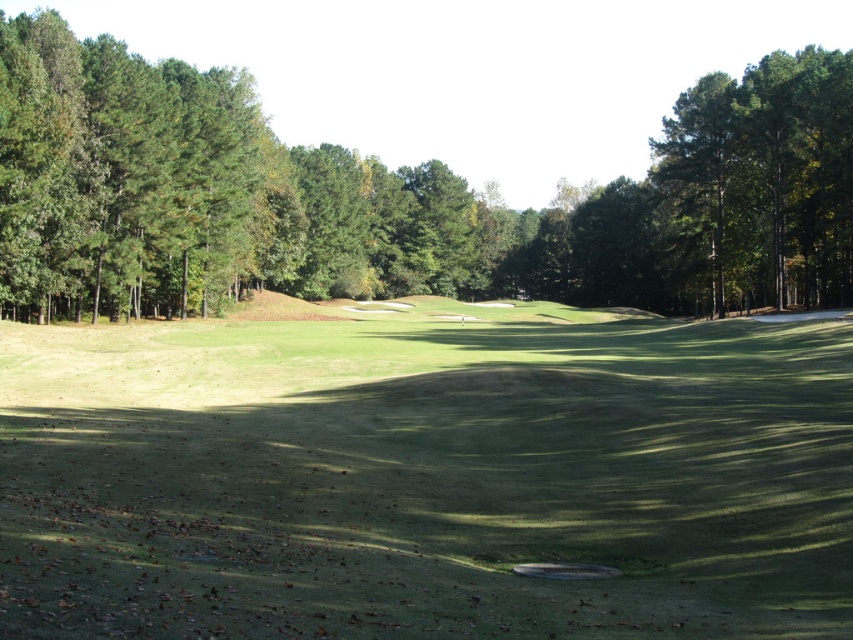
You are a golfer standing on the green grassy field at center and want to hit the ball towards the sand trap in the distance. Which direction should you aim relative to the green leafy tree at center?

Since the green grassy field at center is positioned under the green leafy tree at center, you should aim towards the direction away from the tree to reach the sand trap in the distance.

Looking at this image, you are a golfer standing on the green grassy field at center and want to hit the ball towards the green leafy tree at center. Since both are at the center, which direction should you aim to reach the tree?

The green grassy field at center is in front of the green leafy tree at center, so you should aim towards the area behind the green grassy field at center to reach the green leafy tree at center.